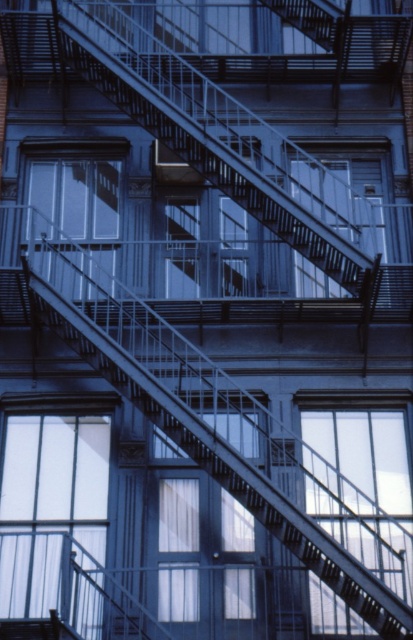
You are standing on the sidewalk looking at the building. Which object is closer to you between the metallic fire escape at upper center and the clear glass window at center?

The metallic fire escape at upper center is closer to you than the clear glass window at center because it is further to the viewer.

You are standing on the fire escape stairs of the building and looking towards the windows. There is a point marked at coordinates point (49,506). Which window is this point located on?

The point (49,506) is on the clear glass window at lower left.